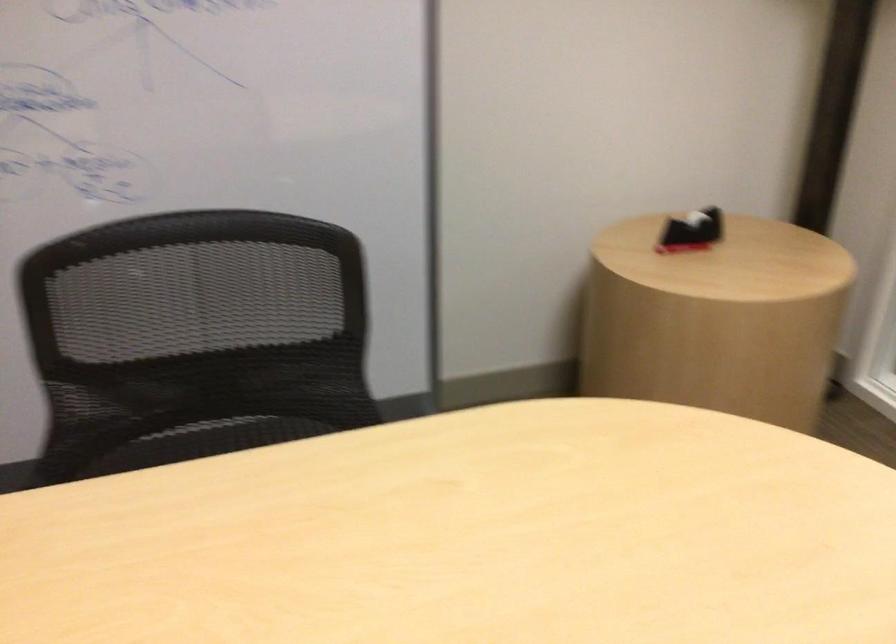
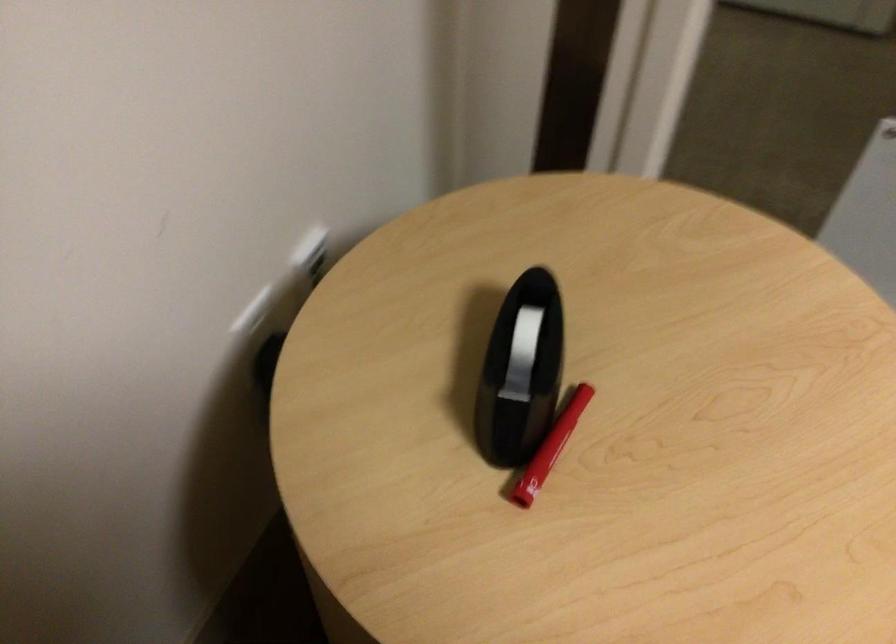
Find the pixel in the second image that matches [678,245] in the first image.

(557, 438)